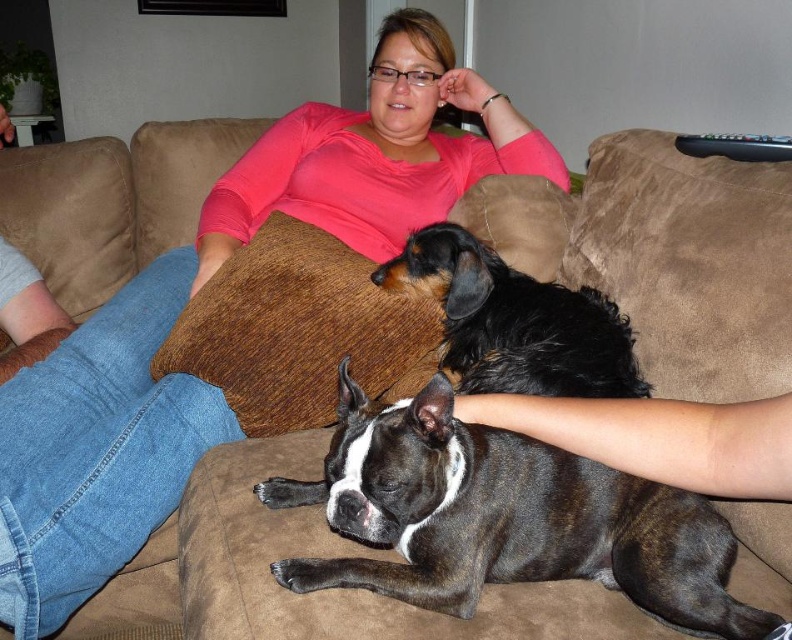
Question: Can you confirm if brindle fur dog at center is positioned above black curly fur dog at center?

Choices:
 (A) no
 (B) yes

Answer: (A)

Question: Does brindle fur dog at center appear on the right side of black curly fur dog at center?

Choices:
 (A) no
 (B) yes

Answer: (A)

Question: Which of the following is the closest to the observer?

Choices:
 (A) black curly fur dog at center
 (B) brindle fur dog at center

Answer: (B)

Question: Which point is closer to the camera?

Choices:
 (A) [638, 600]
 (B) [621, 362]

Answer: (A)

Question: Can you confirm if brindle fur dog at center is wider than black curly fur dog at center?

Choices:
 (A) no
 (B) yes

Answer: (B)